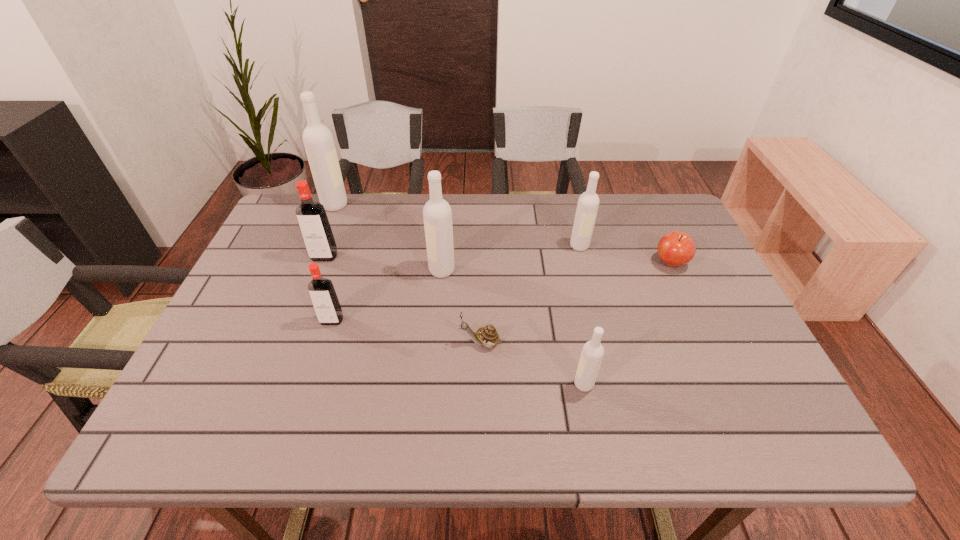
I want to click on vacant space at the right edge, so click(x=728, y=334).

Locate an element on the screen. Image resolution: width=960 pixels, height=540 pixels. empty location between the left red vodka and the seventh farthest object is located at coordinates (402, 300).

You are a GUI agent. You are given a task and a screenshot of the screen. Output one action in this format:
    pyautogui.click(x=<x>, y=<y>)
    Task: Click on the vacant area between the fifth object from left to right and the second tallest vodka
    Image resolution: width=960 pixels, height=540 pixels.
    Given the screenshot: What is the action you would take?
    pyautogui.click(x=461, y=306)

What are the coordinates of `vacant space that's between the fourth object from right to left and the second white vodka from right to left` in the screenshot? It's located at (532, 363).

Locate an element on the screen. This screenshot has width=960, height=540. unoccupied position between the rightmost object and the nearest object is located at coordinates (627, 323).

Locate an element on the screen. The image size is (960, 540). free space between the second nearest object and the biggest white vodka is located at coordinates (408, 274).

Locate an element on the screen. The image size is (960, 540). vacant region between the fifth vodka from left to right and the fifth farthest vodka is located at coordinates (458, 352).

In order to click on vacant area that lies between the smallest white vodka and the leftmost white vodka in this screenshot , I will do `click(460, 294)`.

I want to click on free space between the bigger red vodka and the second tallest object, so click(383, 264).

Locate which object ranks seventh in proximity to the third white vodka from right to left. Please provide its 2D coordinates. Your answer should be formatted as a tuple, i.e. [(x, y)], where the tuple contains the x and y coordinates of a point satisfying the conditions above.

[(675, 248)]